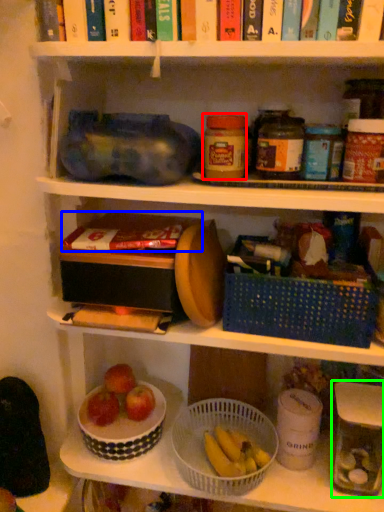
Question: Considering the real-world distances, which object is farthest from bottle (highlighted by a red box)? book (highlighted by a blue box) or glass jar (highlighted by a green box)?

Choices:
 (A) book
 (B) glass jar

Answer: (B)